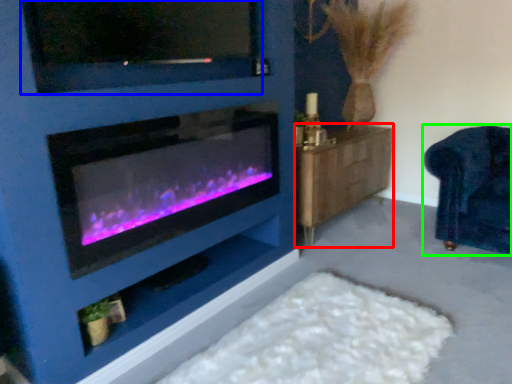
Question: Which is nearer to the dresser (highlighted by a red box)? tv show (highlighted by a blue box) or furniture (highlighted by a green box).

Choices:
 (A) tv show
 (B) furniture

Answer: (B)